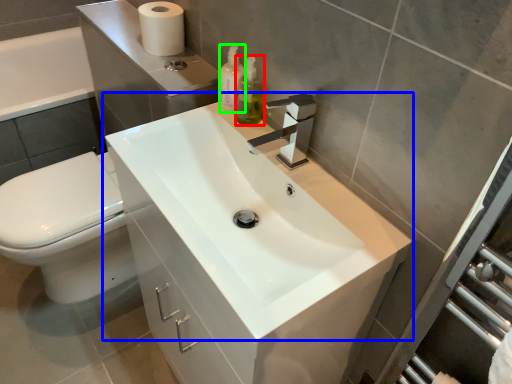
Question: Which object is positioned farthest from soap dispenser (highlighted by a red box)? Select from sink (highlighted by a blue box) and soap dispenser (highlighted by a green box).

Choices:
 (A) sink
 (B) soap dispenser

Answer: (A)